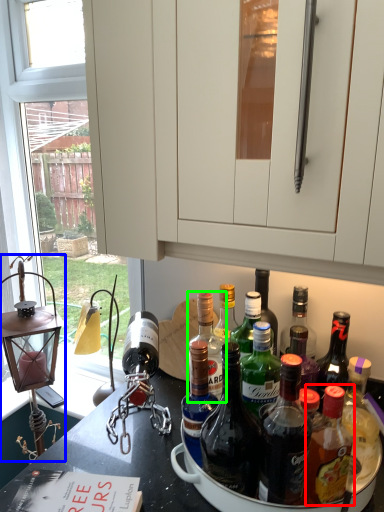
Question: Which object is the closest to the bottle (highlighted by a red box)? Choose among these: oil lamp (highlighted by a blue box) or bottle (highlighted by a green box).

Choices:
 (A) oil lamp
 (B) bottle

Answer: (B)